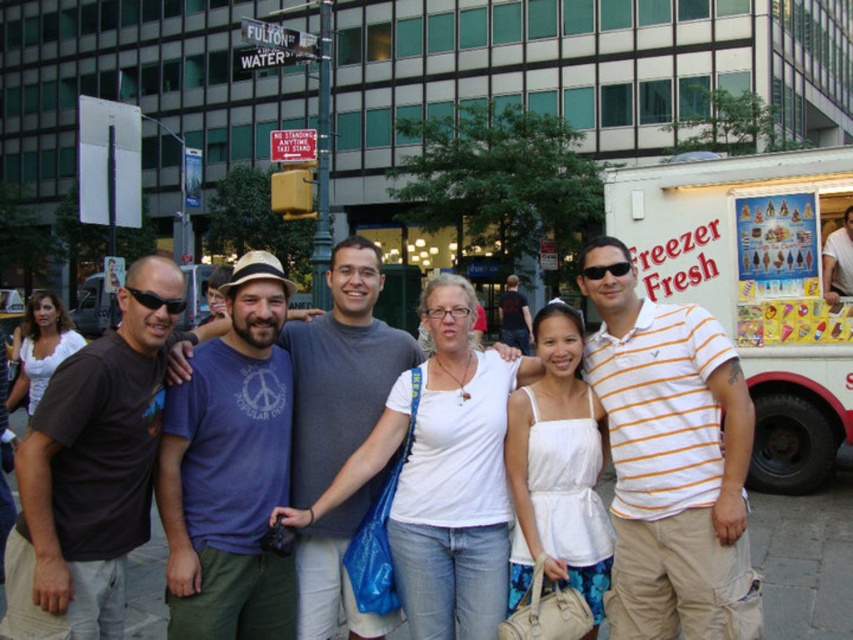
Is white cardboard freezer fresh at right taller than matte white shirt at center?

Indeed, white cardboard freezer fresh at right has a greater height compared to matte white shirt at center.

Can you confirm if white cardboard freezer fresh at right is positioned to the right of matte white shirt at center?

Indeed, white cardboard freezer fresh at right is positioned on the right side of matte white shirt at center.

What do you see at coordinates (753, 285) in the screenshot?
I see `white cardboard freezer fresh at right` at bounding box center [753, 285].

Find the location of a particular element. The width and height of the screenshot is (853, 640). white cardboard freezer fresh at right is located at coordinates coord(753,285).